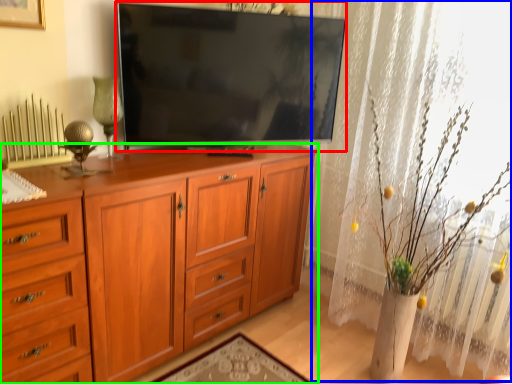
Question: Based on their relative distances, which object is farther from television (highlighted by a red box)? Choose from curtain (highlighted by a blue box) and cabinetry (highlighted by a green box).

Choices:
 (A) curtain
 (B) cabinetry

Answer: (A)